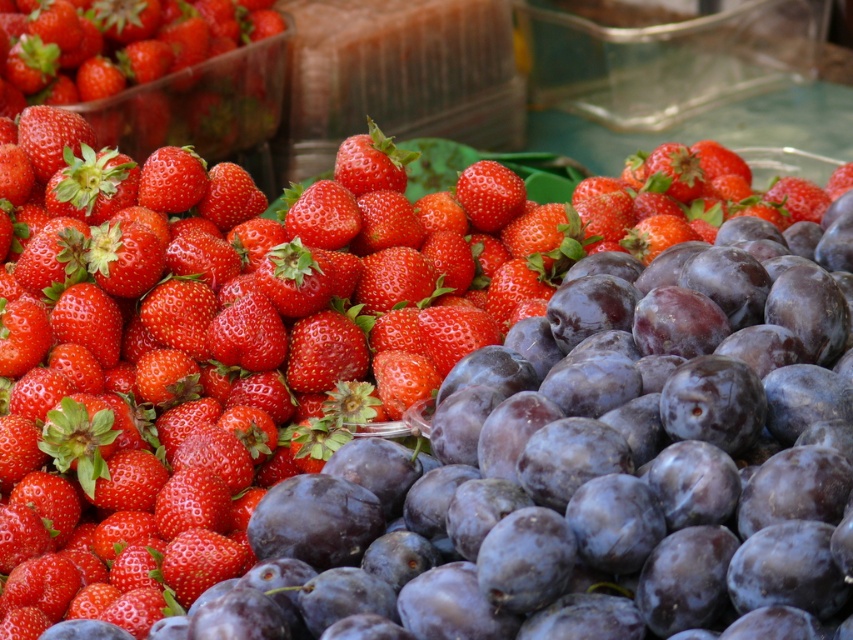
Can you confirm if shiny red strawberries at upper left is positioned below matte red strawberry at upper left?

No, shiny red strawberries at upper left is not below matte red strawberry at upper left.

Who is more distant from viewer, (119, 52) or (206, 184)?

The point (119, 52) is behind.

Is point (233, 3) closer to camera compared to point (177, 196)?

No, it is not.

You are a GUI agent. You are given a task and a screenshot of the screen. Output one action in this format:
    pyautogui.click(x=<x>, y=<y>)
    Task: Click on the shiny red strawberries at upper left
    
    Given the screenshot: What is the action you would take?
    (160, 72)

Measure the distance between shiny red strawberries at upper left and glossy red strawberry at center.

shiny red strawberries at upper left is 4.74 feet away from glossy red strawberry at center.

Identify the location of shiny red strawberries at upper left. The width and height of the screenshot is (853, 640). (160, 72).

Is matte red strawberry at center further to the viewer compared to matte red strawberry at upper left?

Yes.

Which is behind, point (345, 138) or point (171, 163)?

Point (345, 138)

Between point (381, 164) and point (200, 163), which one is positioned in front?

Point (200, 163)

The width and height of the screenshot is (853, 640). In order to click on matte red strawberry at center in this screenshot , I will do `click(370, 163)`.